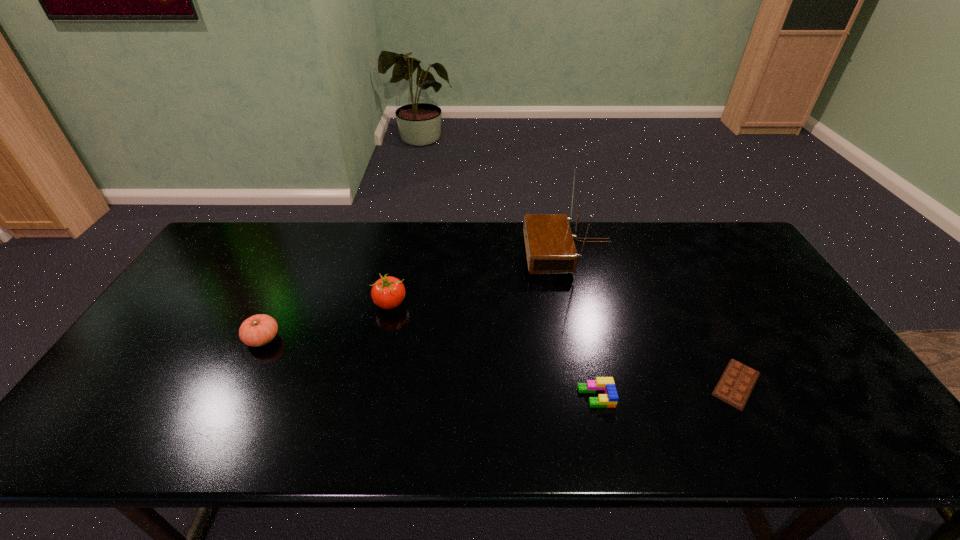
You are a GUI agent. You are given a task and a screenshot of the screen. Output one action in this format:
    pyautogui.click(x=<x>, y=<y>)
    Task: Click on the vacant area at the far left corner
    This screenshot has width=960, height=540.
    Given the screenshot: What is the action you would take?
    pyautogui.click(x=259, y=241)

Identify the location of vacant space at the far right corner of the desktop. The height and width of the screenshot is (540, 960). tap(723, 232).

What are the coordinates of `empty location between the tallest object and the right tomato` in the screenshot? It's located at (480, 278).

I want to click on empty space that is in between the fourth tallest object and the tallest object, so click(583, 325).

The width and height of the screenshot is (960, 540). Find the location of `vacant space that's between the shortest object and the left tomato`. vacant space that's between the shortest object and the left tomato is located at coordinates (499, 361).

Locate an element on the screen. free area in between the fourth shortest object and the farthest object is located at coordinates (480, 278).

Locate an element on the screen. vacant area between the right tomato and the tallest object is located at coordinates (480, 278).

Identify the location of free space between the farthest object and the rightmost object. This screenshot has height=540, width=960. [x=653, y=318].

The image size is (960, 540). I want to click on empty location between the shortest object and the farthest object, so click(653, 318).

Where is `vacant area that lies between the right tomato and the rightmost object`? The height and width of the screenshot is (540, 960). vacant area that lies between the right tomato and the rightmost object is located at coordinates (564, 344).